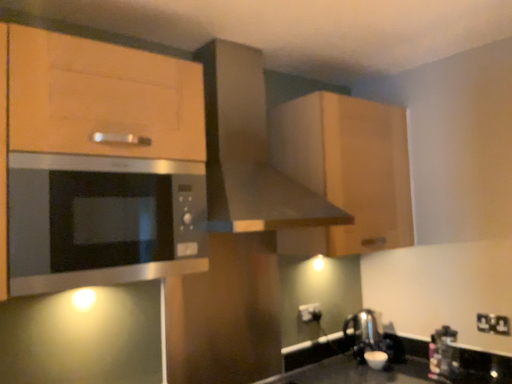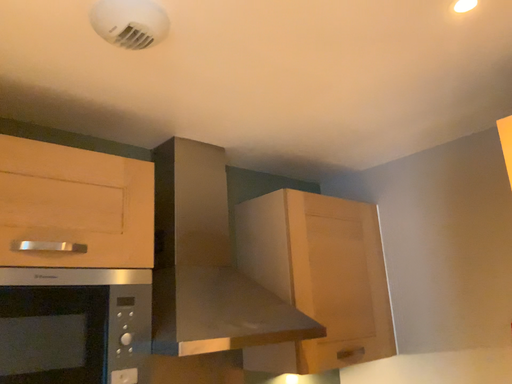
Question: How did the camera likely rotate when shooting the video?

Choices:
 (A) rotated downward
 (B) rotated upward

Answer: (B)